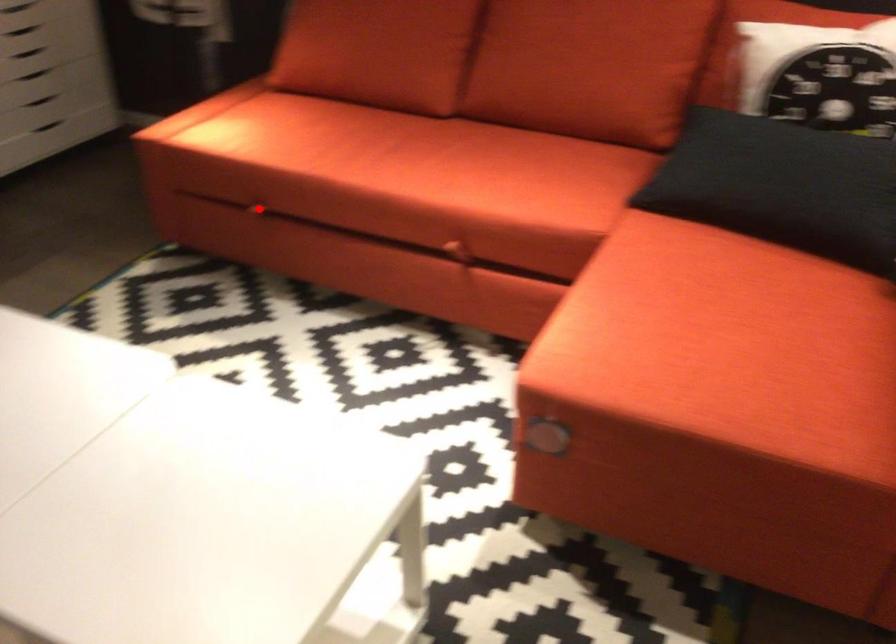
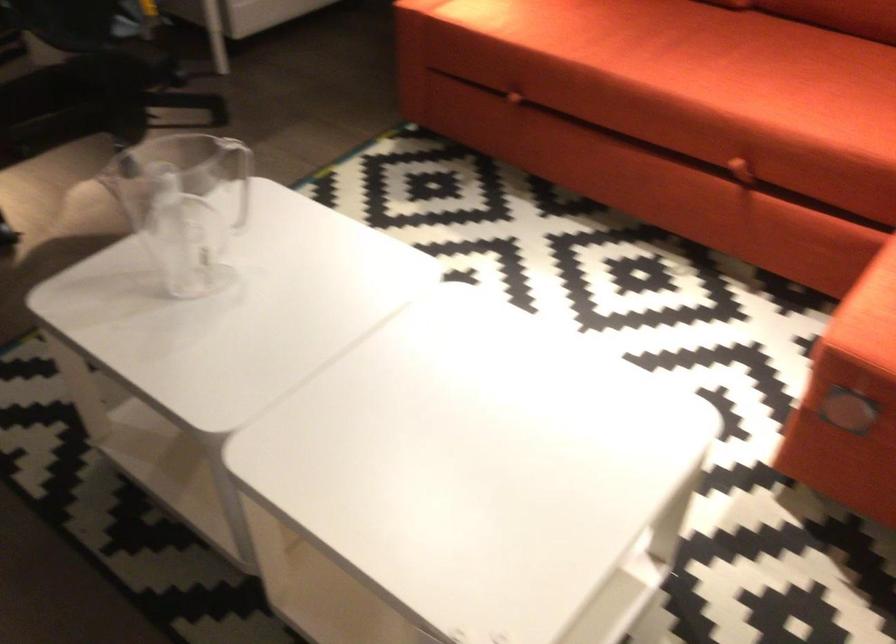
Where in the second image is the point corresponding to the highlighted location from the first image?

(512, 96)